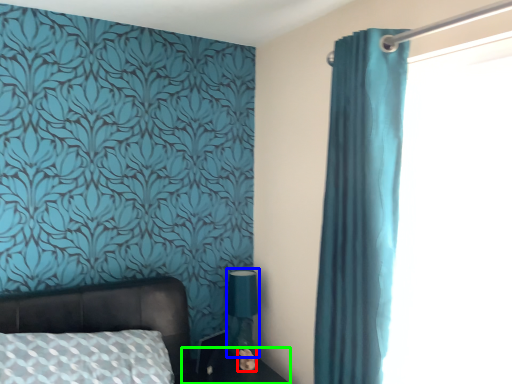
Question: Which object is positioned closest to flower (highlighted by a red box)? Select from table lamp (highlighted by a blue box) and side table (highlighted by a green box).

Choices:
 (A) table lamp
 (B) side table

Answer: (B)